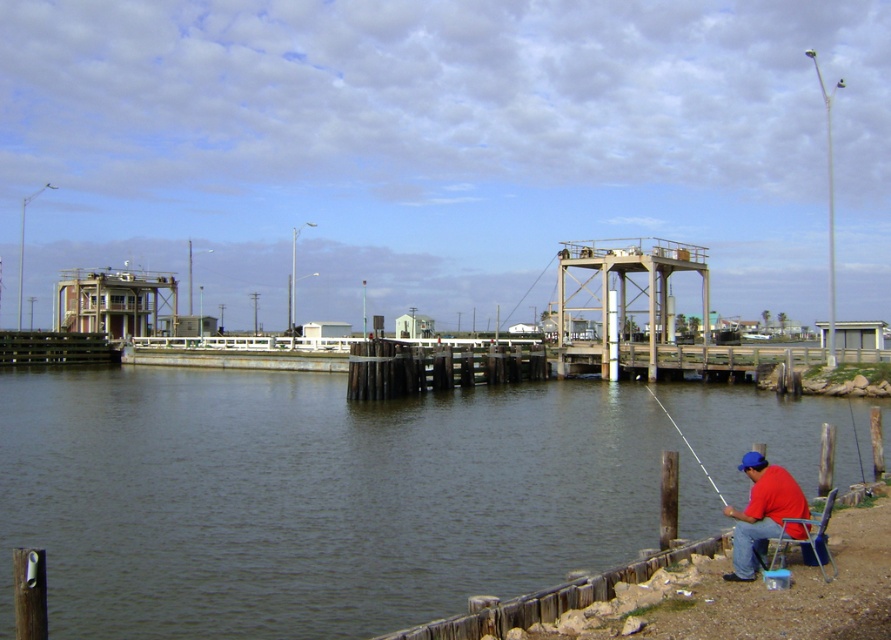
You are standing at the point marked by coordinates point (317, 497). Based on the scene description, what is the object located at this coordinate?

The object located at point (317, 497) is the dark gray water at lower left.

Consider the image. You are standing on the wooden dock and see the red matte shirt at lower right and the blue plastic chair at lower right. Which object is closer to the water edge?

The red matte shirt at lower right is closer to the water edge because it is positioned to the left of the blue plastic chair at lower right, and since the dock edge is on the right side of the image, the left side would be closer to the edge.